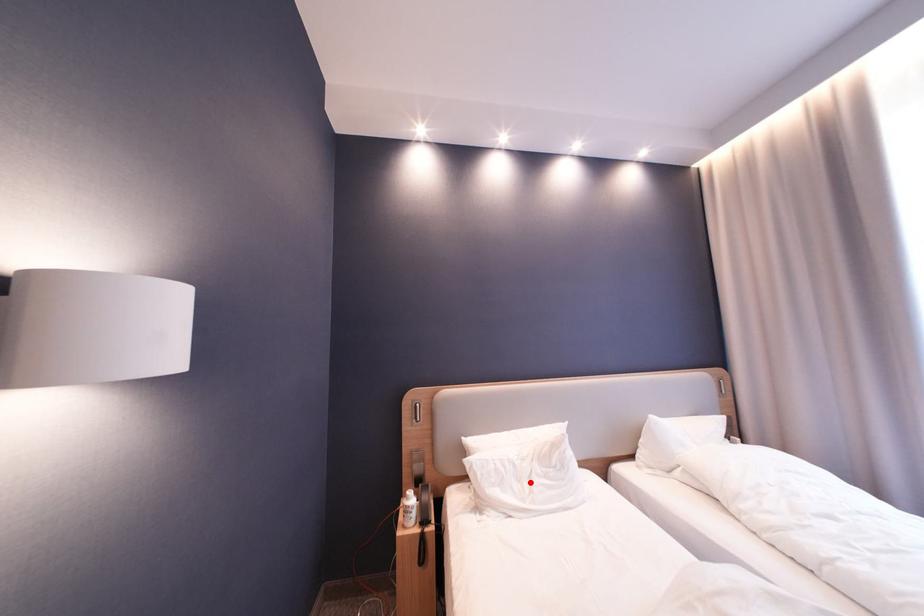
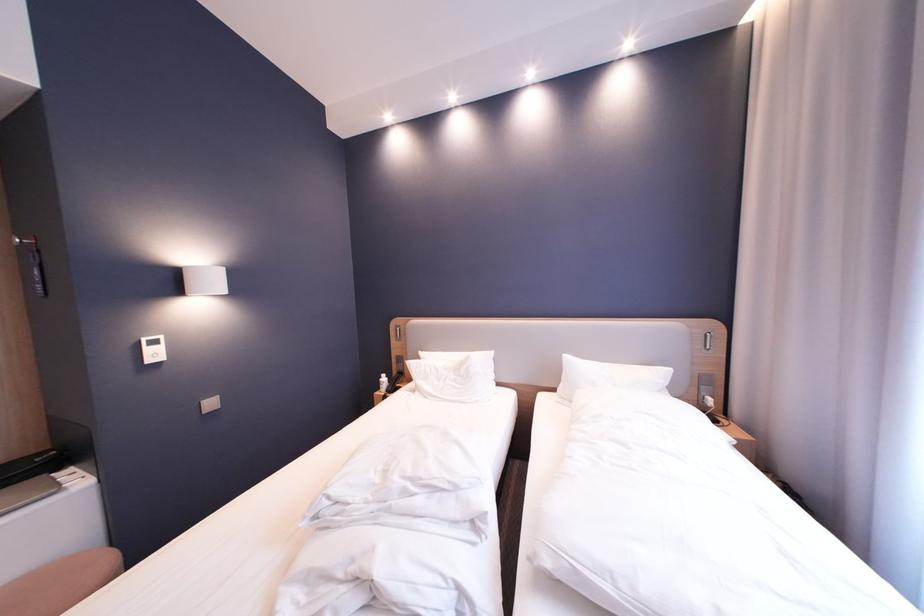
The point at the highlighted location is marked in the first image. Where is the corresponding point in the second image?

(450, 382)